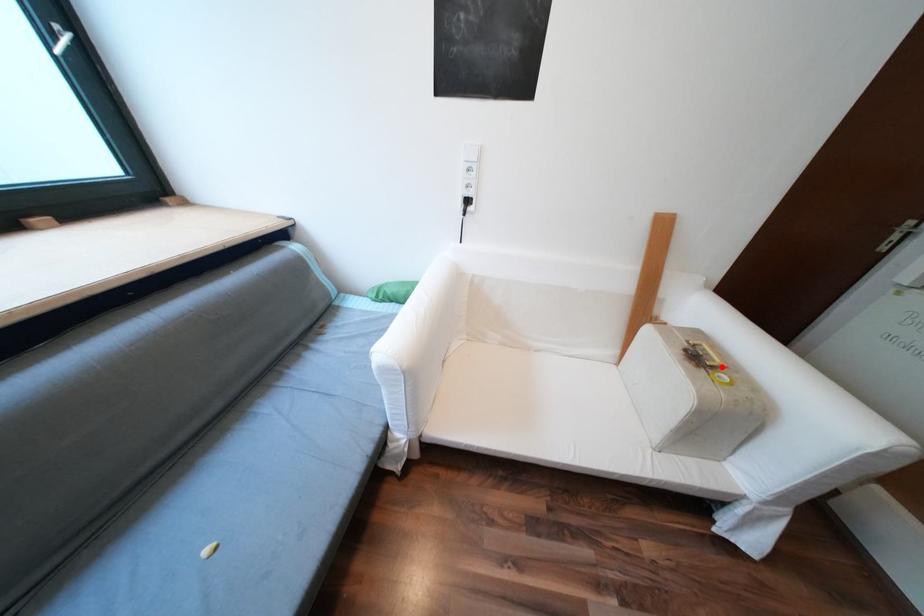
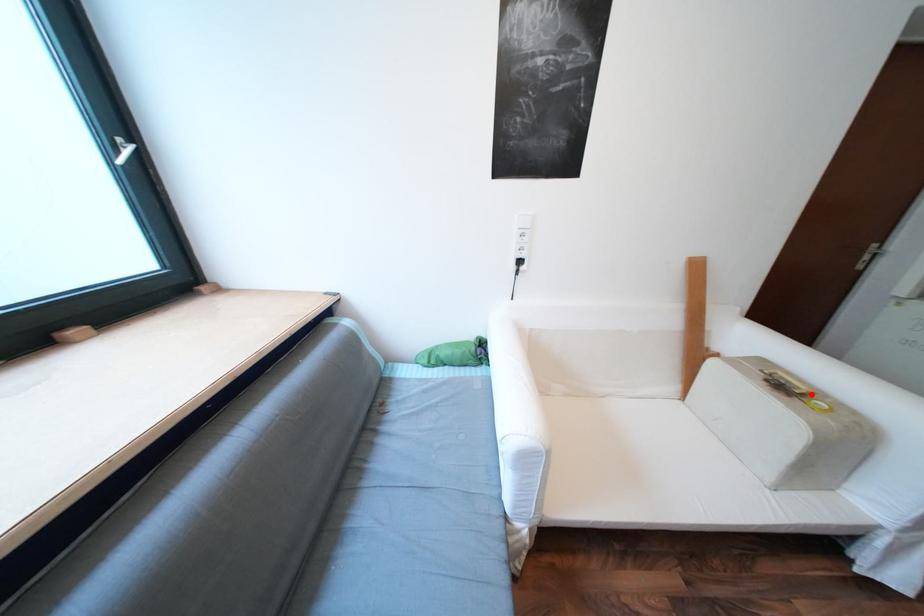
I am providing you with two images of the same scene from different viewpoints. A red point is marked on the first image and another point is marked on the second image. Is the red point in image1 aligned with the point shown in image2?

Yes